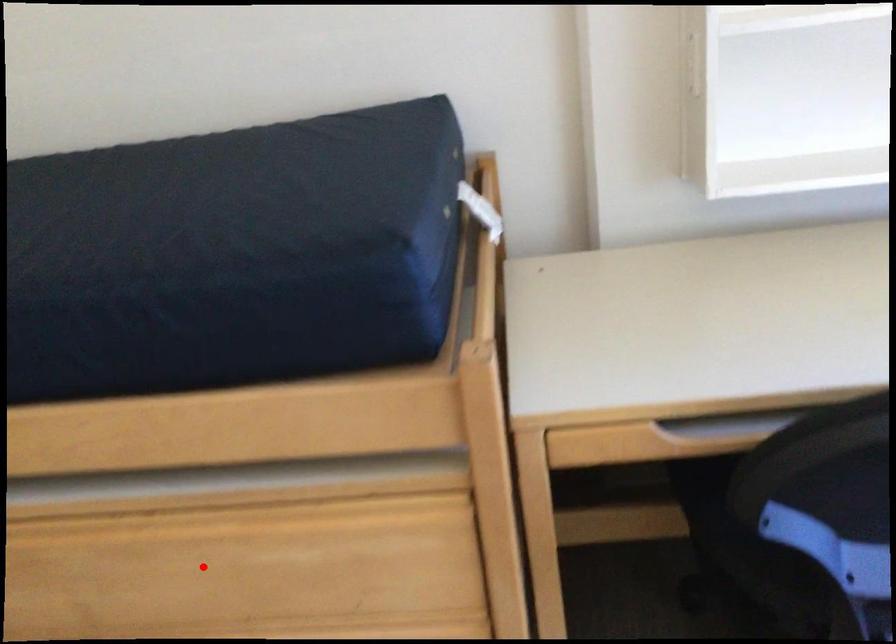
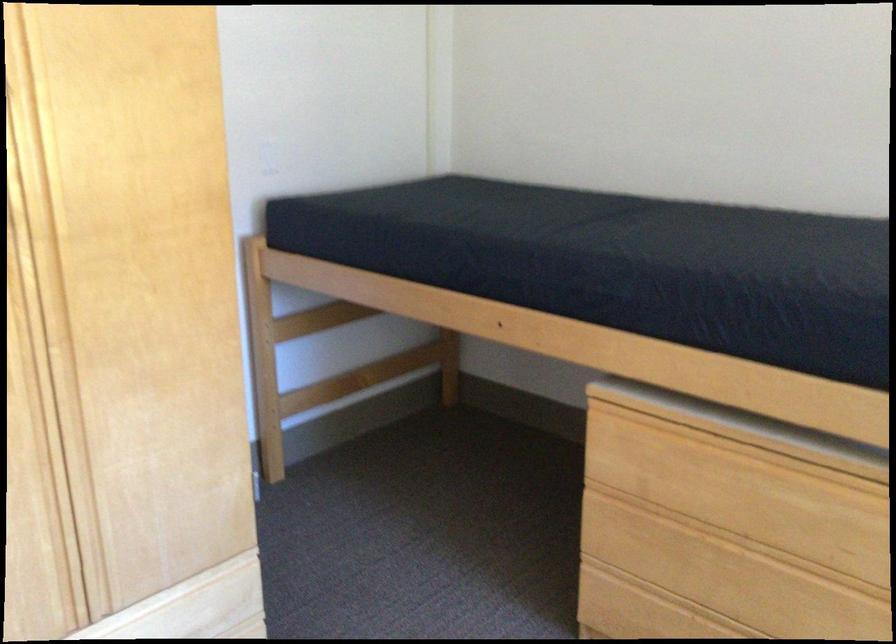
The point at the highlighted location is marked in the first image. Where is the corresponding point in the second image?

(728, 488)